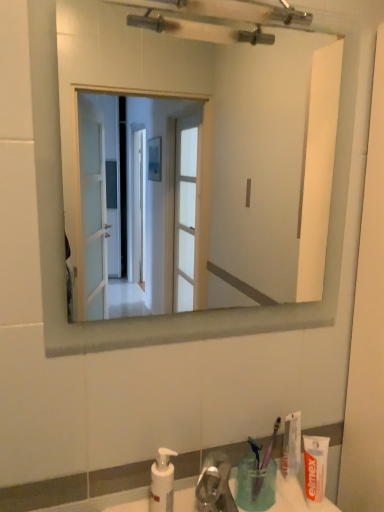
Question: Considering the relative positions of white glossy mirror at upper center and blue plastic toothbrush at lower center, which appears as the second toothbrush when viewed from the right, in the image provided, is white glossy mirror at upper center to the left or to the right of blue plastic toothbrush at lower center, which appears as the second toothbrush when viewed from the right,?

Choices:
 (A) right
 (B) left

Answer: (B)

Question: In the image, is white glossy mirror at upper center positioned in front of or behind blue plastic toothbrush at lower center, which appears as the second toothbrush when viewed from the right?

Choices:
 (A) behind
 (B) front

Answer: (B)

Question: Estimate the real-world distances between objects in this image. Which object is farther from the white matte toothpaste at lower right, the first toothpaste when ordered from front to back?

Choices:
 (A) translucent plastic cup at lower right
 (B) purple plastic toothbrush at lower right, acting as the 2th toothbrush starting from the left
 (C) white matte toothpaste at lower right, the 1th toothpaste viewed from the back
 (D) white glossy mirror at upper center
 (E) blue plastic toothbrush at lower center, which appears as the second toothbrush when viewed from the right

Answer: (D)

Question: Considering the real-world distances, which object is farthest from the white matte toothpaste at lower right, which appears as the second toothpaste when viewed from the back?

Choices:
 (A) translucent plastic cup at lower right
 (B) purple plastic toothbrush at lower right, acting as the 2th toothbrush starting from the left
 (C) white plastic soap dispenser at lower center
 (D) white matte toothpaste at lower right, positioned as the 2th toothpaste in front-to-back order
 (E) blue plastic toothbrush at lower center, which appears as the second toothbrush when viewed from the right

Answer: (C)